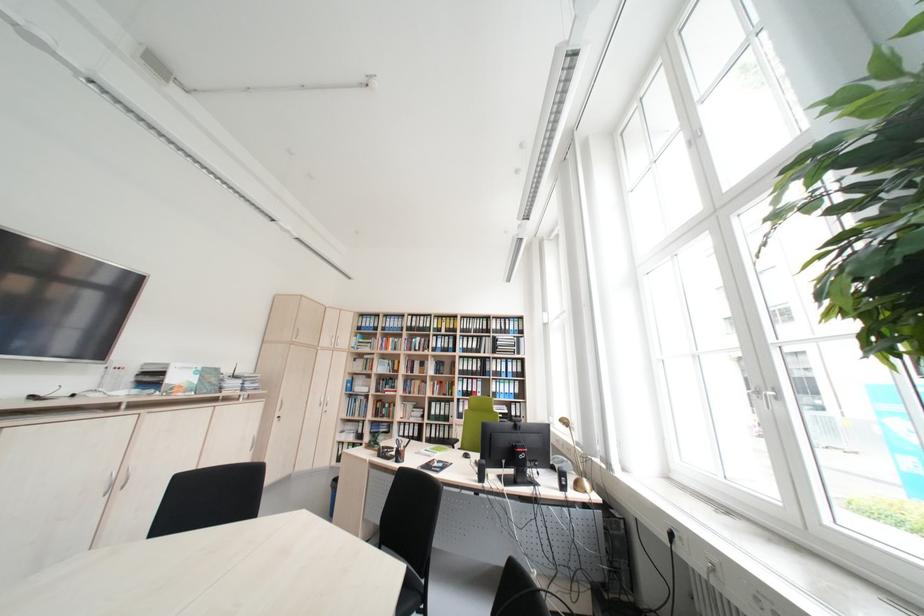
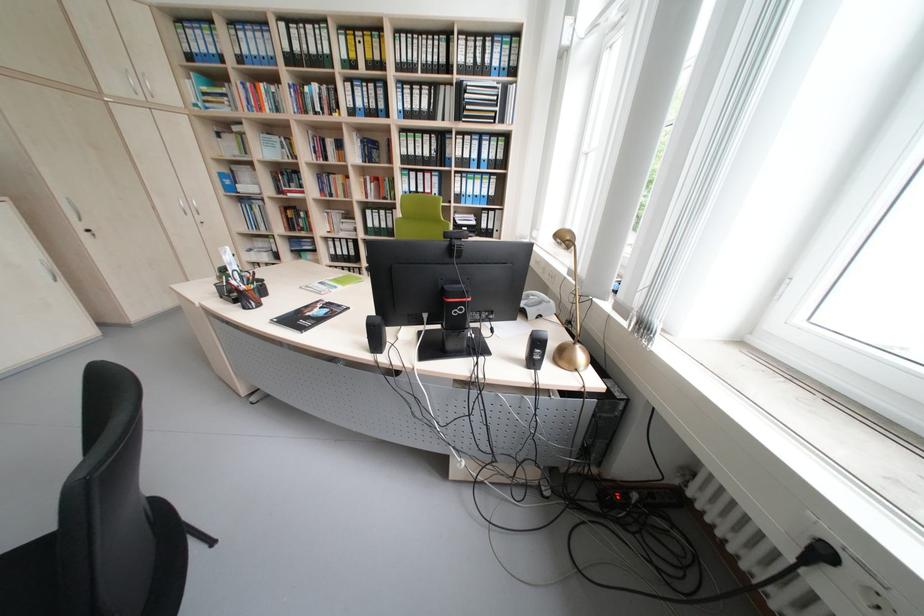
Find the pixel in the second image that matches (x=504, y=353) in the first image.

(468, 119)